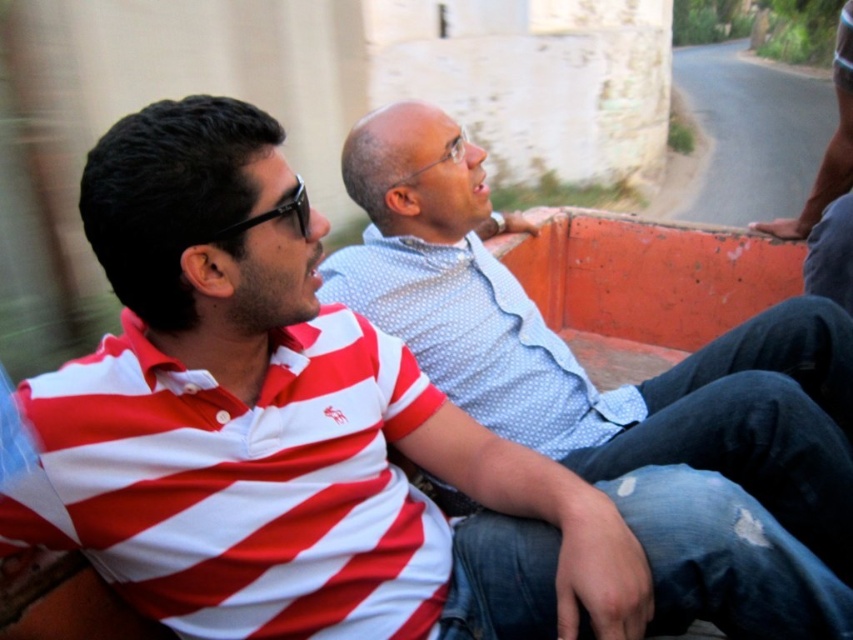
Question: Which point is farther from the camera taking this photo?

Choices:
 (A) (606, 422)
 (B) (822, 212)

Answer: (B)

Question: Considering the relative positions of white dotted shirt at center and dark gray fabric pants at right in the image provided, where is white dotted shirt at center located with respect to dark gray fabric pants at right?

Choices:
 (A) below
 (B) above

Answer: (A)

Question: Considering the relative positions of white dotted shirt at center and dark gray fabric pants at right in the image provided, where is white dotted shirt at center located with respect to dark gray fabric pants at right?

Choices:
 (A) right
 (B) left

Answer: (B)

Question: Is white dotted shirt at center bigger than dark gray fabric pants at right?

Choices:
 (A) yes
 (B) no

Answer: (B)